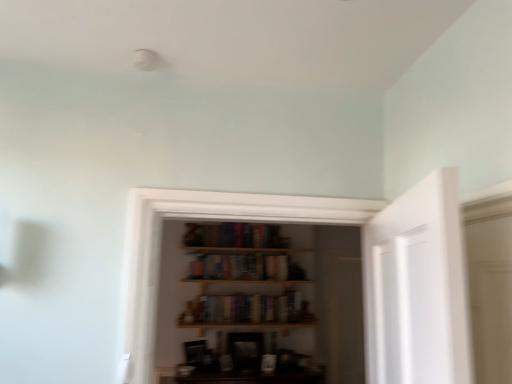
Question: Can you confirm if hardcover books at center, the 2th book when ordered from top to bottom, is taller than hardcover books at center, which is counted as the 2th book, starting from the bottom?

Choices:
 (A) no
 (B) yes

Answer: (B)

Question: Is hardcover books at center, the first book from the bottom, further to camera compared to hardcover books at center, which is counted as the 2th book, starting from the bottom?

Choices:
 (A) no
 (B) yes

Answer: (A)

Question: Considering the relative sizes of hardcover books at center, the first book from the bottom, and hardcover books at center, the first book from the top, in the image provided, is hardcover books at center, the first book from the bottom, thinner than hardcover books at center, the first book from the top,?

Choices:
 (A) yes
 (B) no

Answer: (A)

Question: Can you confirm if hardcover books at center, the first book from the bottom, is bigger than hardcover books at center, which is counted as the 2th book, starting from the bottom?

Choices:
 (A) no
 (B) yes

Answer: (A)

Question: From a real-world perspective, is hardcover books at center, the 2th book when ordered from top to bottom, beneath hardcover books at center, which is counted as the 2th book, starting from the bottom?

Choices:
 (A) no
 (B) yes

Answer: (B)

Question: From the image's perspective, does hardcover books at center, the first book from the bottom, appear higher than hardcover books at center, which is counted as the 2th book, starting from the bottom?

Choices:
 (A) yes
 (B) no

Answer: (B)

Question: From the image's perspective, would you say hardcover books at center, which is counted as the 2th book, starting from the bottom, is positioned over hardcover books at center, the 2th book when ordered from top to bottom?

Choices:
 (A) yes
 (B) no

Answer: (A)

Question: Is hardcover books at center, which is counted as the 2th book, starting from the bottom, looking in the opposite direction of hardcover books at center, the 2th book when ordered from top to bottom?

Choices:
 (A) no
 (B) yes

Answer: (A)

Question: Considering the relative sizes of hardcover books at center, the first book from the top, and hardcover books at center, the first book from the bottom, in the image provided, is hardcover books at center, the first book from the top, bigger than hardcover books at center, the first book from the bottom,?

Choices:
 (A) no
 (B) yes

Answer: (B)

Question: Are hardcover books at center, the first book from the top, and hardcover books at center, the first book from the bottom, beside each other?

Choices:
 (A) no
 (B) yes

Answer: (A)

Question: Does hardcover books at center, which is counted as the 2th book, starting from the bottom, have a smaller size compared to hardcover books at center, the first book from the bottom?

Choices:
 (A) no
 (B) yes

Answer: (A)

Question: Is hardcover books at center, which is counted as the 2th book, starting from the bottom, closer to camera compared to hardcover books at center, the 2th book when ordered from top to bottom?

Choices:
 (A) no
 (B) yes

Answer: (A)

Question: Looking at their shapes, would you say hardcover books at center, the first book from the top, is wider or thinner than hardcover books at center, the first book from the bottom?

Choices:
 (A) wide
 (B) thin

Answer: (A)